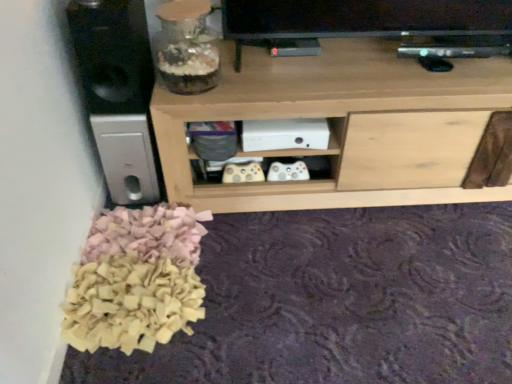
Identify the location of unoccupied region to the right of translucent glass jar at upper left. (250, 71).